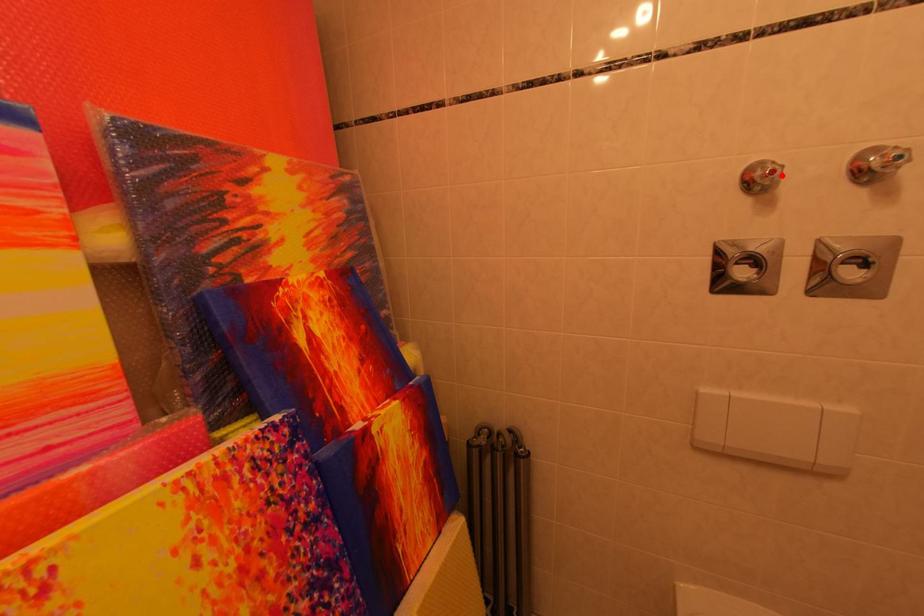
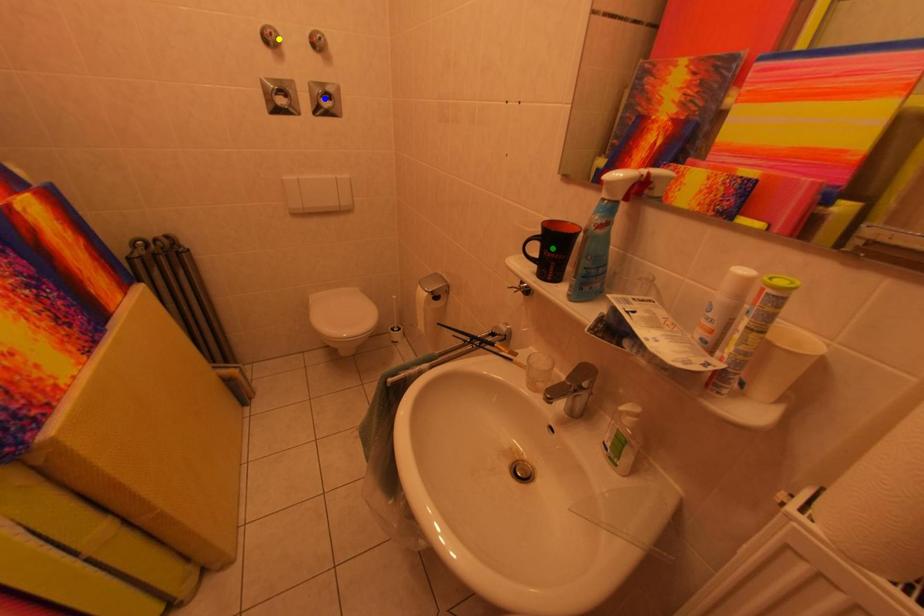
Question: I am providing you with two images of the same scene from different viewpoints. A red point is marked on the first image. You are given multiple points on the second image. In image 2, which mark is for the same physical point as the one in image 1?

Choices:
 (A) blue point
 (B) green point
 (C) yellow point

Answer: (C)